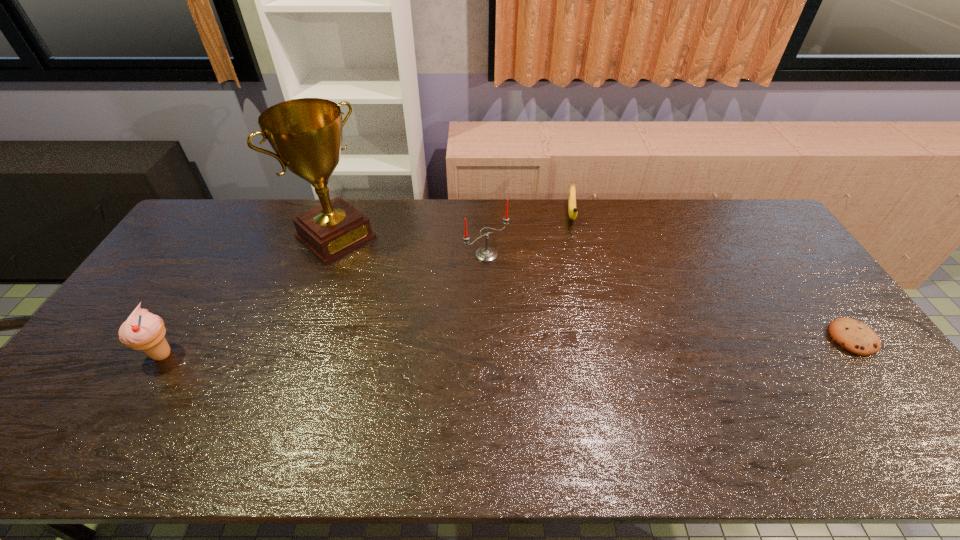
The image size is (960, 540). Find the location of `the leftmost object`. the leftmost object is located at coordinates (143, 330).

Where is `the shortest object`? The image size is (960, 540). the shortest object is located at coordinates (854, 336).

You are a GUI agent. You are given a task and a screenshot of the screen. Output one action in this format:
    pyautogui.click(x=<x>, y=<y>)
    Task: Click on the cookie
    
    Given the screenshot: What is the action you would take?
    pyautogui.click(x=854, y=336)

I want to click on the third object from right to left, so click(x=485, y=254).

I want to click on banana, so click(x=572, y=209).

The width and height of the screenshot is (960, 540). I want to click on the fourth tallest object, so click(x=572, y=209).

You are a GUI agent. You are given a task and a screenshot of the screen. Output one action in this format:
    pyautogui.click(x=<x>, y=<y>)
    Task: Click on the second object from left to right
    The width and height of the screenshot is (960, 540).
    Given the screenshot: What is the action you would take?
    pyautogui.click(x=306, y=134)

Locate an element on the screen. The width and height of the screenshot is (960, 540). the tallest object is located at coordinates (306, 134).

The image size is (960, 540). Find the location of `vacant space situated 0.070m on the left of the leftmost object`. vacant space situated 0.070m on the left of the leftmost object is located at coordinates (118, 355).

Identify the location of blank space located on the left of the cookie. (761, 338).